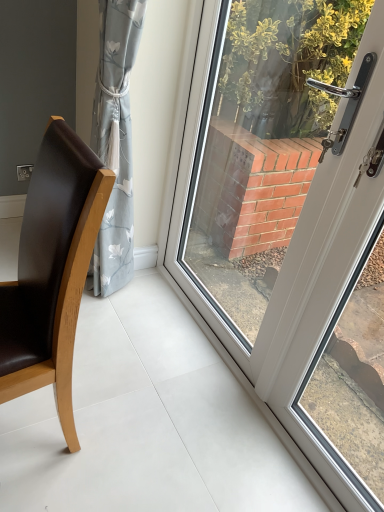
Where is `unoccupied region to the right of brown leather chair at left`? Image resolution: width=384 pixels, height=512 pixels. unoccupied region to the right of brown leather chair at left is located at coordinates (140, 420).